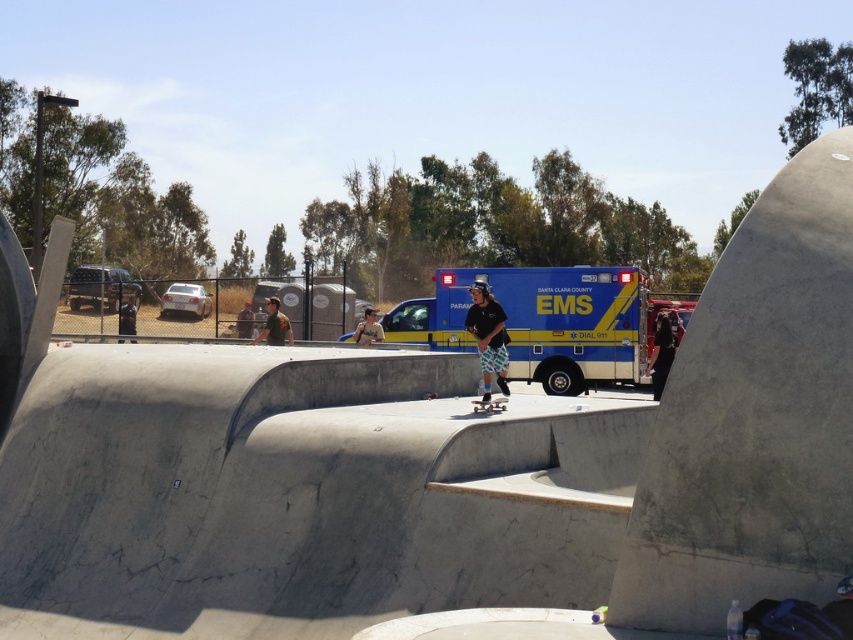
Does point (184, 284) lie behind point (129, 324)?

Yes, it is.

Which is in front, point (181, 291) or point (123, 307)?

Positioned in front is point (123, 307).

The height and width of the screenshot is (640, 853). What do you see at coordinates (184, 300) in the screenshot? I see `silver metallic car at center-left` at bounding box center [184, 300].

In order to click on silver metallic car at center-left in this screenshot , I will do `click(184, 300)`.

Between blue/white fiberglass ambulance at center and dark blue jeans at center, which one has less height?

With less height is dark blue jeans at center.

Does point (645, 285) lie behind point (132, 316)?

No.

I want to click on blue/white fiberglass ambulance at center, so click(547, 321).

Does matte black skateboarder at center lie in front of wooden skateboard at center?

No, it is behind wooden skateboard at center.

Between matte black skateboarder at center and wooden skateboard at center, which one is positioned higher?

matte black skateboarder at center is above.

Is point (502, 355) closer to viewer compared to point (502, 397)?

That is False.

This screenshot has height=640, width=853. I want to click on matte black skateboarder at center, so click(488, 337).